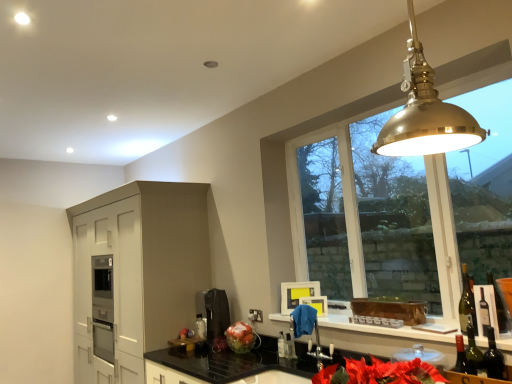
Question: Considering the positions of white glossy window sill at lower center and translucent glass bottle at lower center in the image, is white glossy window sill at lower center bigger or smaller than translucent glass bottle at lower center?

Choices:
 (A) big
 (B) small

Answer: (A)

Question: Considering the relative positions of white glossy window sill at lower center and translucent glass bottle at lower center in the image provided, is white glossy window sill at lower center to the left or to the right of translucent glass bottle at lower center?

Choices:
 (A) right
 (B) left

Answer: (A)

Question: Estimate the real-world distances between objects in this image. Which object is closer to the brass pendant light at upper right?

Choices:
 (A) green glass wine bottle at right, the 2th wine bottle from the back
 (B) translucent glass bottle at lower center
 (C) black granite countertop at lower center
 (D) white glossy window sill at lower center
 (E) metallic silver faucet at lower center

Answer: (A)

Question: Which of these objects is positioned farthest from the translucent glass bottle at lower center?

Choices:
 (A) brass pendant light at upper right
 (B) metallic silver faucet at lower center
 (C) white glossy window sill at lower center
 (D) green glass wine bottle at right, acting as the first wine bottle starting from the back
 (E) matte white cabinet at left

Answer: (A)